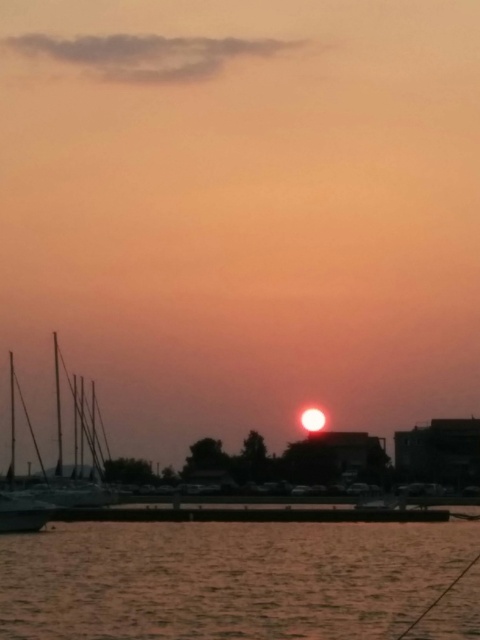
Question: Considering the real-world distances, which object is closest to the silvery metallic sailboat at left?

Choices:
 (A) silvery metallic masts at left
 (B) smooth water at lower center

Answer: (B)

Question: Is smooth water at lower center below silvery metallic masts at left?

Choices:
 (A) no
 (B) yes

Answer: (A)

Question: Is smooth water at lower center to the right of silvery metallic sailboat at left from the viewer's perspective?

Choices:
 (A) yes
 (B) no

Answer: (A)

Question: Which of the following is the farthest from the observer?

Choices:
 (A) smooth water at lower center
 (B) silvery metallic masts at left

Answer: (B)

Question: Which object is positioned farthest from the silvery metallic sailboat at left?

Choices:
 (A) smooth water at lower center
 (B) silvery metallic masts at left

Answer: (B)

Question: Is smooth water at lower center positioned behind silvery metallic masts at left?

Choices:
 (A) no
 (B) yes

Answer: (A)